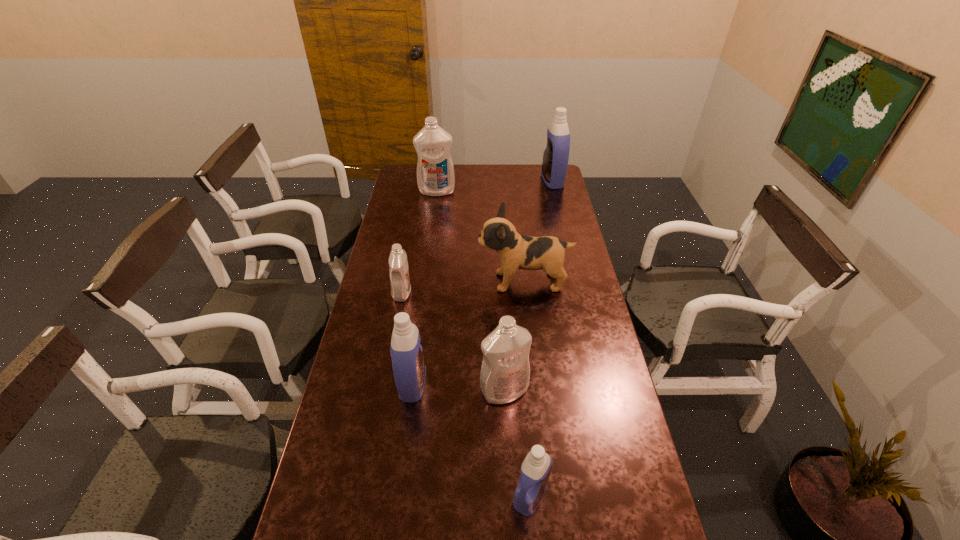
Identify the location of blank region between the second biggest white detergent and the farthest white detergent. This screenshot has width=960, height=540. (470, 291).

I want to click on empty space between the puppy and the smallest white detergent, so click(x=463, y=287).

Where is `vacant space that's between the second biggest blue detergent and the farthest white detergent`? Image resolution: width=960 pixels, height=540 pixels. vacant space that's between the second biggest blue detergent and the farthest white detergent is located at coordinates (425, 287).

At what (x,y) coordinates should I click in order to perform the action: click on blank region between the nearest white detergent and the second farthest blue detergent. Please return your answer as a coordinate pair (x, y). This screenshot has height=540, width=960. Looking at the image, I should click on (459, 387).

Identify the location of vacant area between the biggest blue detergent and the second smallest blue detergent. This screenshot has width=960, height=540. (483, 282).

The height and width of the screenshot is (540, 960). In order to click on vacant region between the puppy and the smallest blue detergent in this screenshot , I will do `click(527, 388)`.

The width and height of the screenshot is (960, 540). I want to click on free space between the second nearest white detergent and the nearest detergent, so click(x=467, y=394).

The height and width of the screenshot is (540, 960). I want to click on free point between the rightmost blue detergent and the puppy, so click(539, 231).

Identify which object is the closest to the puppy. Please provide its 2D coordinates. Your answer should be formatted as a tuple, i.e. [(x, y)], where the tuple contains the x and y coordinates of a point satisfying the conditions above.

[(400, 284)]

Where is `object that is the third closest one to the farthest white detergent`? The height and width of the screenshot is (540, 960). object that is the third closest one to the farthest white detergent is located at coordinates (400, 284).